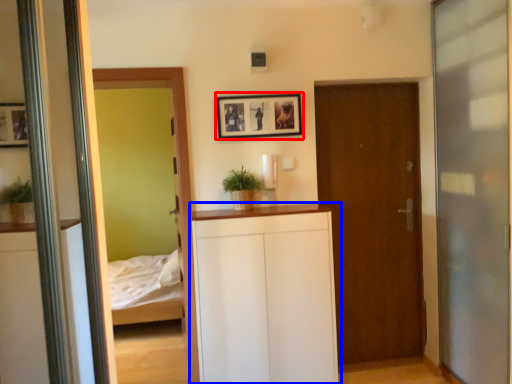
Question: Which object is further to the camera taking this photo, picture frame (highlighted by a red box) or dresser (highlighted by a blue box)?

Choices:
 (A) picture frame
 (B) dresser

Answer: (A)